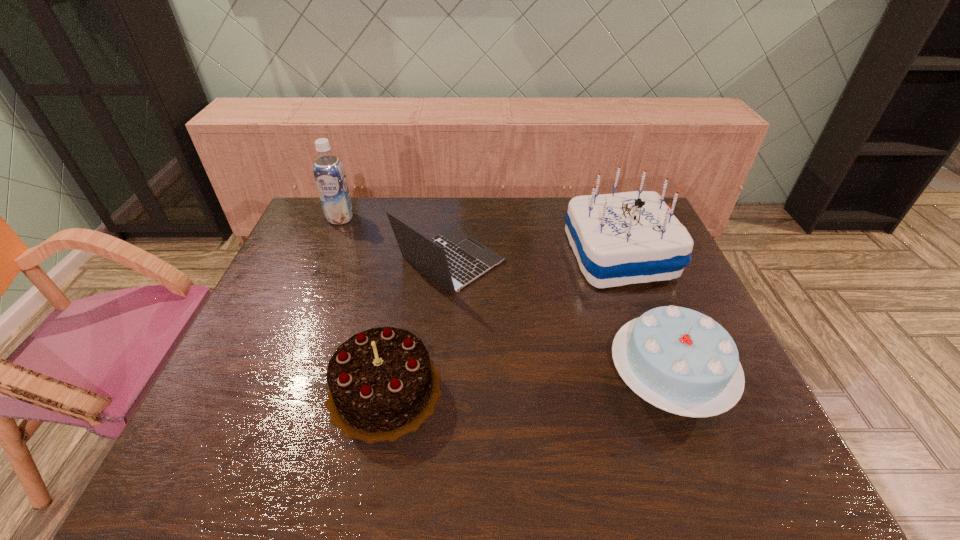
Where is `the leftmost object`? The image size is (960, 540). the leftmost object is located at coordinates (329, 173).

I want to click on the tallest birthday cake, so click(x=624, y=238).

Image resolution: width=960 pixels, height=540 pixels. Identify the location of laptop_computer. click(453, 259).

This screenshot has width=960, height=540. What are the coordinates of `the leftmost birthday cake` in the screenshot? It's located at (382, 384).

Where is `free space located on the label of the soya milk`? free space located on the label of the soya milk is located at coordinates (329, 245).

Image resolution: width=960 pixels, height=540 pixels. Find the location of `blank area located on the front of the tallest birthday cake`. blank area located on the front of the tallest birthday cake is located at coordinates (653, 343).

The height and width of the screenshot is (540, 960). Find the location of `vacant point located at the front screen of the laptop_computer`. vacant point located at the front screen of the laptop_computer is located at coordinates (557, 262).

Identify the location of vacant space positioned on the right of the leftmost birthday cake. The image size is (960, 540). (516, 389).

Identify the location of soya milk situated at the far edge. The height and width of the screenshot is (540, 960). (329, 173).

I want to click on birthday cake located at the far edge, so click(x=624, y=238).